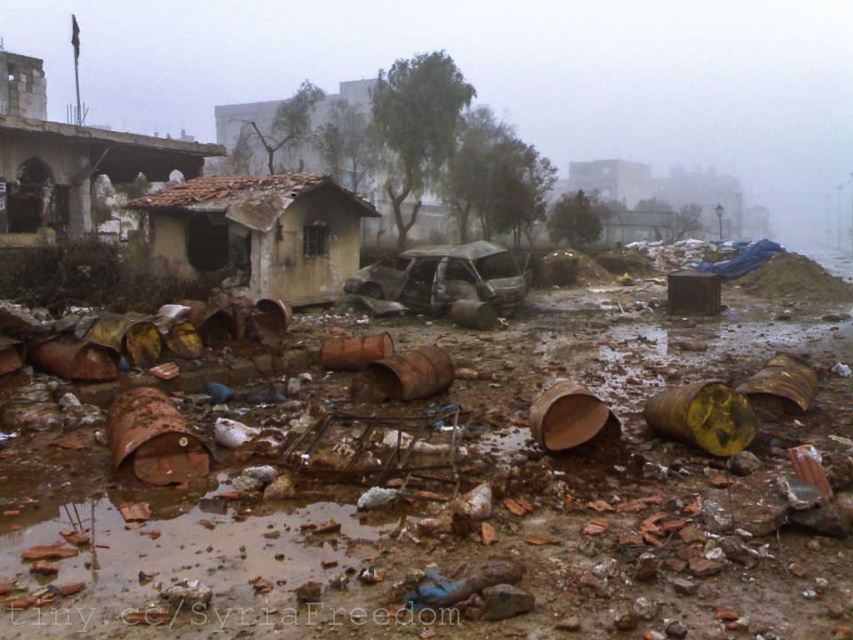
You are standing at the point labeled point (258, 234) in this scene. What structure are you currently on?

The point labeled point (258, 234) is on the yellowish concrete hut at center.

You are navigating through a war zone and need to reach a safe zone located at coordinates 0.5, 0.5. You see a yellowish concrete hut at center. Is the hut blocking your path to the safe zone?

The yellowish concrete hut at center is located at point (258, 234), which is closer to the bottom left compared to the safe zone at (426, 320). Therefore, the hut is not directly blocking the path to the safe zone, but you may need to navigate around it depending on the terrain.

In the scene shown: You are a rescue worker trying to navigate through the debris field. You need to locate the rusty corrugated metal hut at upper left. According to the coordinates provided, where exactly is it positioned in the scene?

The rusty corrugated metal hut at upper left is located at coordinates point (x=67, y=161), which means it is positioned in the upper left area of the scene.